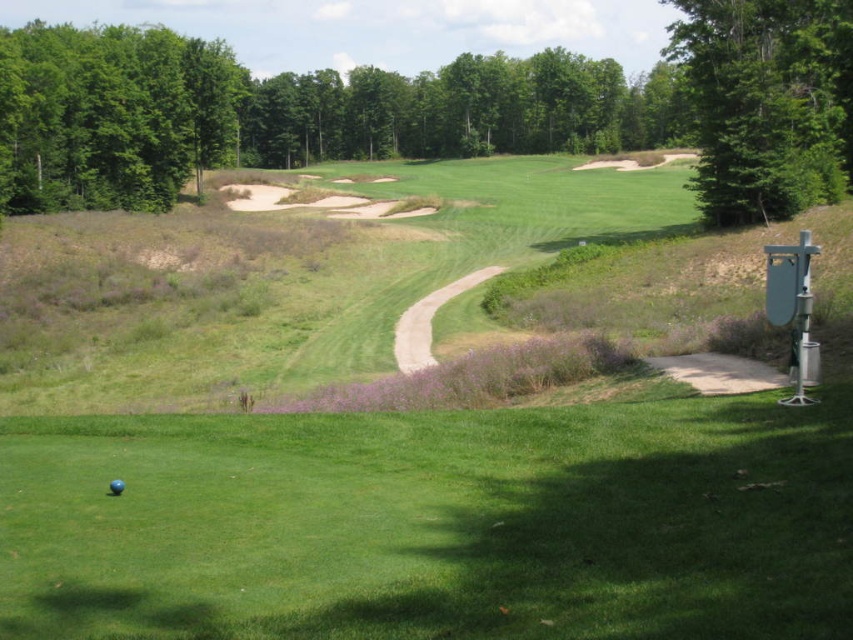
You are a golfer standing at the blue matte golf ball at lower left and want to hit the ball towards the green leafy tree at upper right. Based on the scene description, will the ball roll towards the tree or away from it? Explain your reasoning.

→ The green leafy tree at upper right is positioned on the right side of the blue matte golf ball at lower left. Since the ball is at the lower left and the tree is to its right, the golfer would need to hit the ball towards the upper right direction. However, the scene mentions a winding path in the middle ground curving towards the background, which might influence the ball path. But according to the object description, the tree is directly to the right of the ball, so if hit accurately, the ball should be